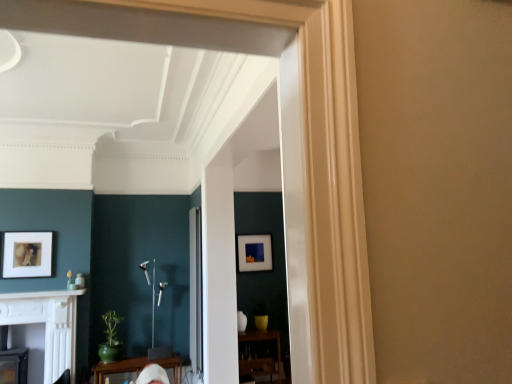
Question: Should I look upward or downward to see clear glass door at center?

Choices:
 (A) down
 (B) up

Answer: (A)

Question: Can you confirm if wooden table at lower center, the second table positioned from the left, is smaller than matte black picture frame at center, the first picture frame from the back?

Choices:
 (A) no
 (B) yes

Answer: (A)

Question: From the image's perspective, is wooden table at lower center, the second table positioned from the left, beneath matte black picture frame at center, which ranks as the 1th picture frame in right-to-left order?

Choices:
 (A) yes
 (B) no

Answer: (A)

Question: Is wooden table at lower center, the second table positioned from the left, positioned in front of matte black picture frame at center, the first picture frame from the back?

Choices:
 (A) yes
 (B) no

Answer: (A)

Question: Is wooden table at lower center, marked as the 1th table in a back-to-front arrangement, bigger than matte black picture frame at center, which ranks as the 1th picture frame in right-to-left order?

Choices:
 (A) yes
 (B) no

Answer: (A)

Question: Does wooden table at lower center, marked as the 1th table in a back-to-front arrangement, contain matte black picture frame at center, the 2th picture frame positioned from the left?

Choices:
 (A) yes
 (B) no

Answer: (B)

Question: Does wooden table at lower center, which is the second table in front-to-back order, appear on the right side of matte black picture frame at center, the first picture frame from the back?

Choices:
 (A) no
 (B) yes

Answer: (B)

Question: Is clear glass door at center positioned with its back to wooden table at lower center, marked as the 1th table in a back-to-front arrangement?

Choices:
 (A) no
 (B) yes

Answer: (A)

Question: From a real-world perspective, is clear glass door at center beneath wooden table at lower center, marked as the 1th table in a back-to-front arrangement?

Choices:
 (A) yes
 (B) no

Answer: (B)

Question: Can you confirm if clear glass door at center is shorter than wooden table at lower center, the second table positioned from the left?

Choices:
 (A) no
 (B) yes

Answer: (A)

Question: From the image's perspective, is clear glass door at center on wooden table at lower center, marked as the 1th table in a back-to-front arrangement?

Choices:
 (A) no
 (B) yes

Answer: (B)

Question: Is clear glass door at center touching wooden table at lower center, which is the second table in front-to-back order?

Choices:
 (A) yes
 (B) no

Answer: (B)

Question: Does clear glass door at center have a smaller size compared to wooden table at lower center, which is the second table in front-to-back order?

Choices:
 (A) no
 (B) yes

Answer: (B)

Question: Is matte black picture frame at center, the first picture frame from the back, positioned with its back to white glossy fireplace at lower left?

Choices:
 (A) yes
 (B) no

Answer: (B)